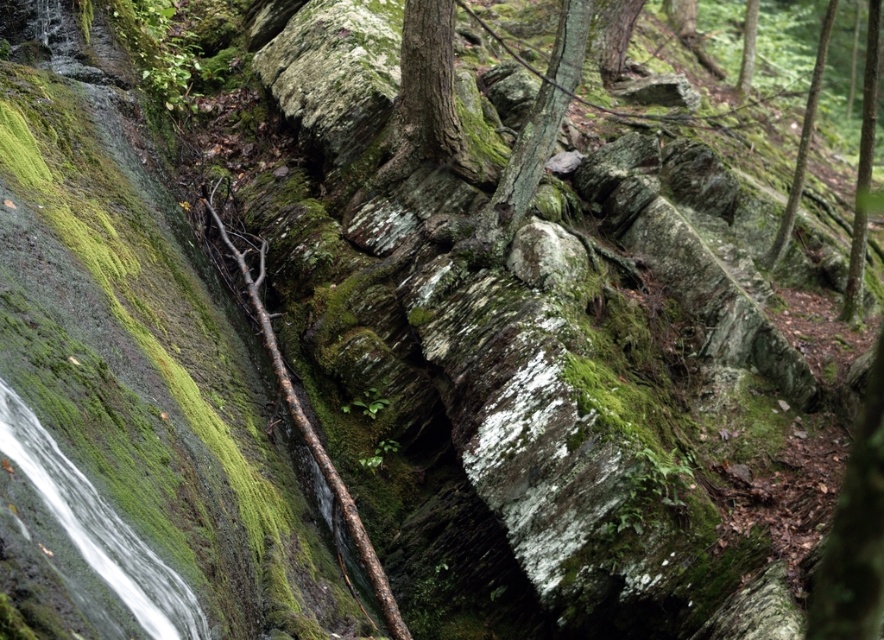
You are a hiker who has just arrived at the mossy rocky landscape. You need to locate the smooth bark tree at center. According to the coordinates provided, where should you look to find it?

The smooth bark tree at center is located at point coordinates of (x=427, y=97).

What is the spatial relationship between the green mossy tree trunk at center and the green mossy tree at upper center?

The green mossy tree trunk at center is in front of the green mossy tree at upper center.

You are a hiker trying to determine which tree is taller in the forest scene. You see a smooth bark tree at center and a green mossy tree at upper right. Which tree is taller?

The green mossy tree at upper right is taller than the smooth bark tree at center.